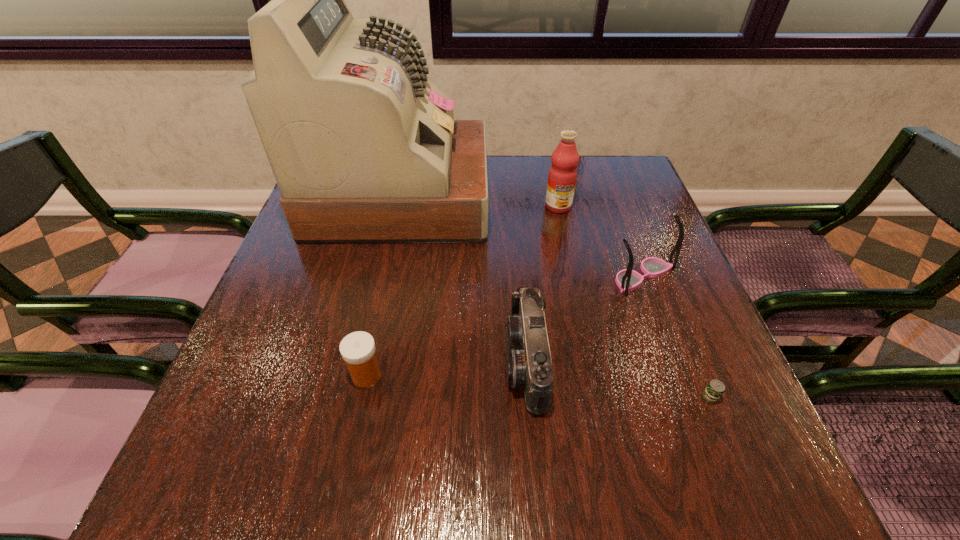
The width and height of the screenshot is (960, 540). I want to click on the tallest object, so click(364, 149).

Identify the location of fruit juice. This screenshot has width=960, height=540. (562, 176).

This screenshot has width=960, height=540. Find the location of `the fourth object from left to right`. the fourth object from left to right is located at coordinates (562, 176).

Where is `spectacles`? The height and width of the screenshot is (540, 960). spectacles is located at coordinates (627, 280).

Find the location of `the third farthest object`. the third farthest object is located at coordinates (627, 280).

This screenshot has width=960, height=540. Identify the location of camcorder. (529, 364).

This screenshot has width=960, height=540. Identify the location of medicine. (358, 348).

Locate an element on the screen. The height and width of the screenshot is (540, 960). the shortest object is located at coordinates (714, 390).

The image size is (960, 540). Find the location of `vacant region located on the operating side of the cash register`. vacant region located on the operating side of the cash register is located at coordinates (531, 197).

You are a GUI agent. You are given a task and a screenshot of the screen. Output one action in this format:
    pyautogui.click(x=<x>, y=<y>)
    Task: Click on the vacant space located 0.400m on the label of the fruit juice
    The width and height of the screenshot is (960, 540).
    Given the screenshot: What is the action you would take?
    [x=586, y=339]